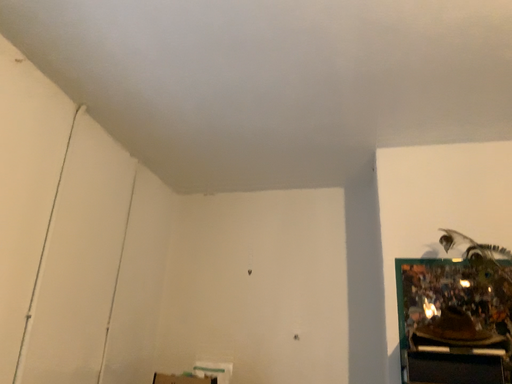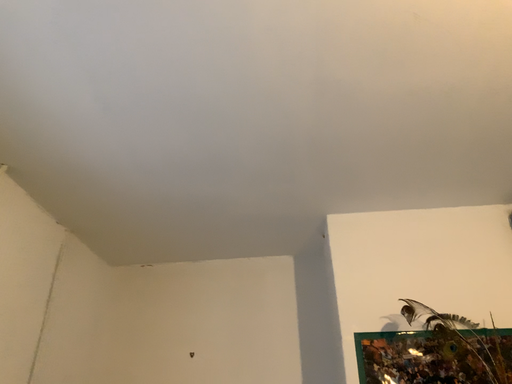
Question: Which way did the camera rotate in the video?

Choices:
 (A) rotated upward
 (B) rotated downward

Answer: (A)